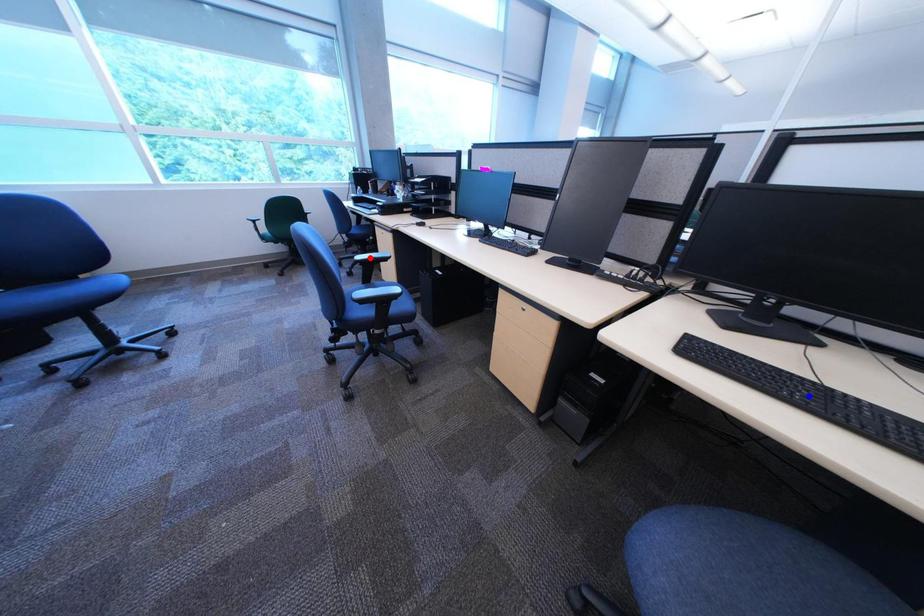
Question: Two points are marked on the image. Which point is closer to the camera?

Choices:
 (A) Blue point is closer.
 (B) Red point is closer.

Answer: (A)